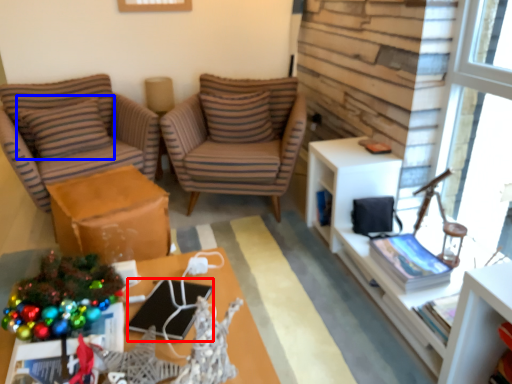
Question: Among these objects, which one is nearest to the camera, laptop (highlighted by a red box) or pillow (highlighted by a blue box)?

Choices:
 (A) laptop
 (B) pillow

Answer: (A)